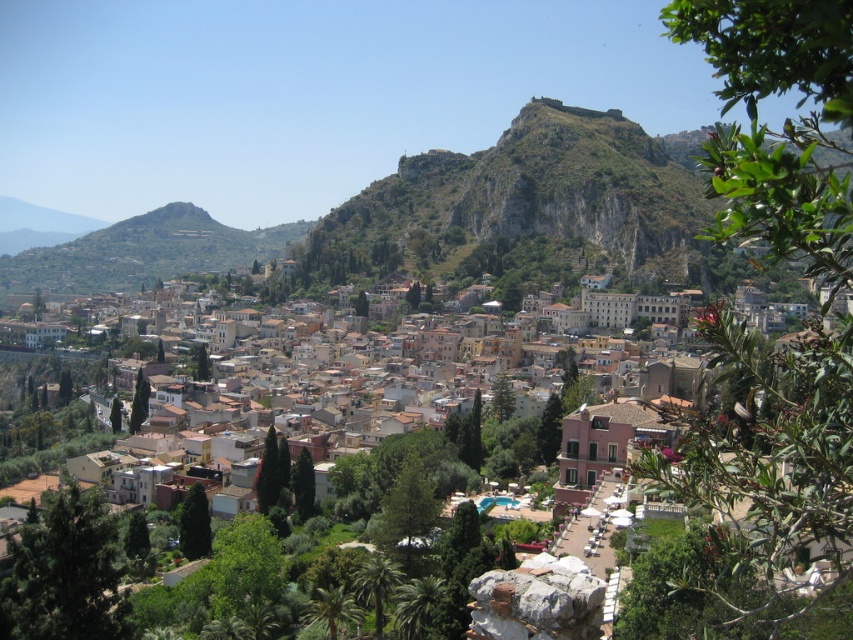
Which is in front, point (633, 240) or point (165, 259)?

Point (633, 240) is in front.

Does green rocky hill at center have a greater height compared to green grassy hillside at center?

Yes.

Is point (543, 180) in front of point (57, 250)?

Yes, point (543, 180) is closer to viewer.

The image size is (853, 640). Identify the location of green rocky hill at center. (524, 196).